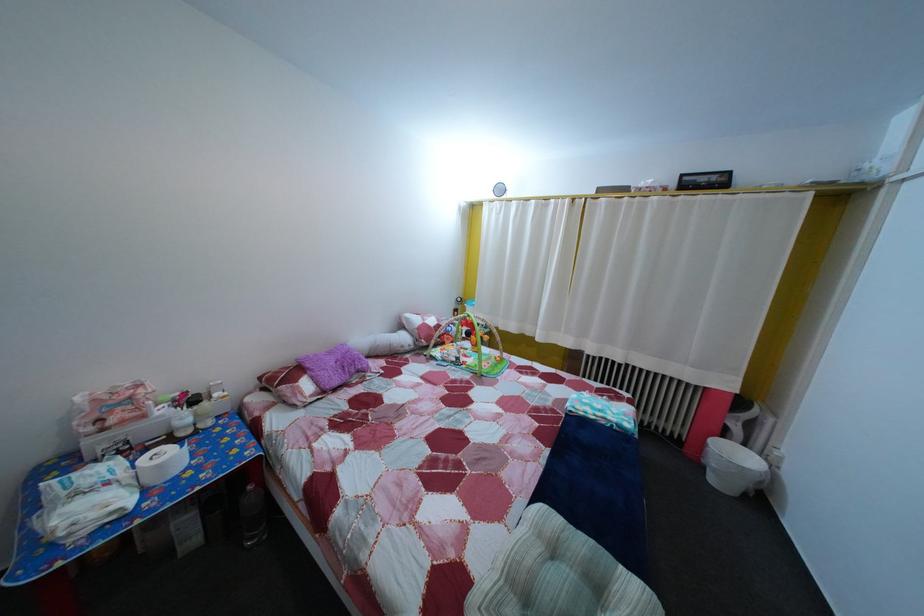
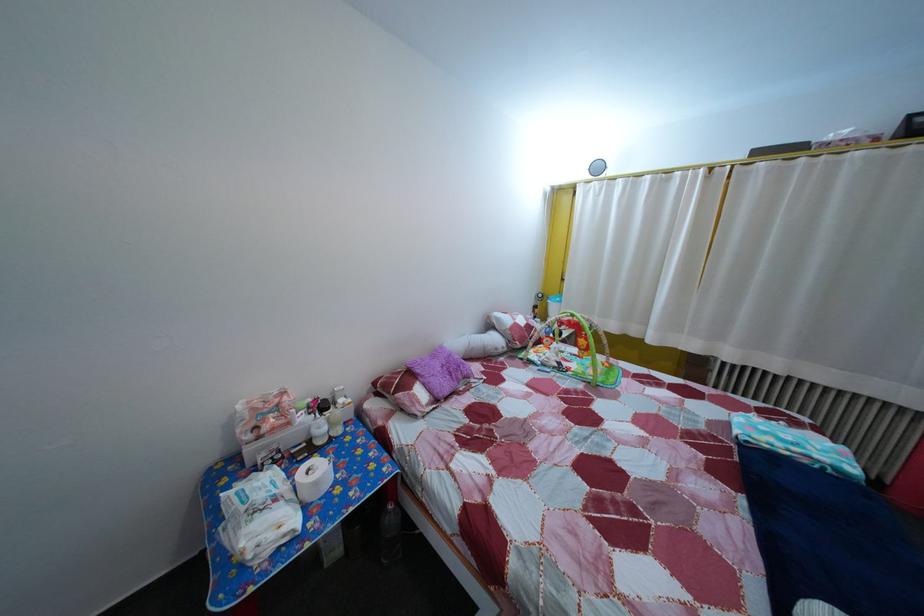
Locate, in the second image, the point that corresponds to pixel 169 475 in the first image.

(325, 491)